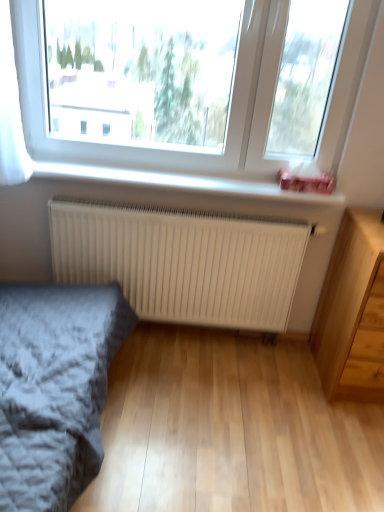
Find the location of a particular element. Image resolution: width=384 pixels, height=512 pixels. free space above white plastic window sill at upper center (from a real-world perspective) is located at coordinates (168, 173).